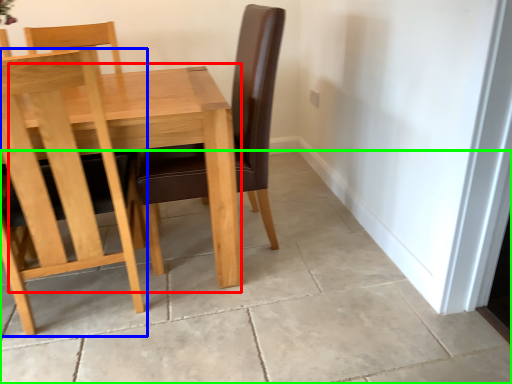
Question: Which is nearer to the table (highlighted by a red box)? chair (highlighted by a blue box) or concrete (highlighted by a green box).

Choices:
 (A) chair
 (B) concrete

Answer: (A)